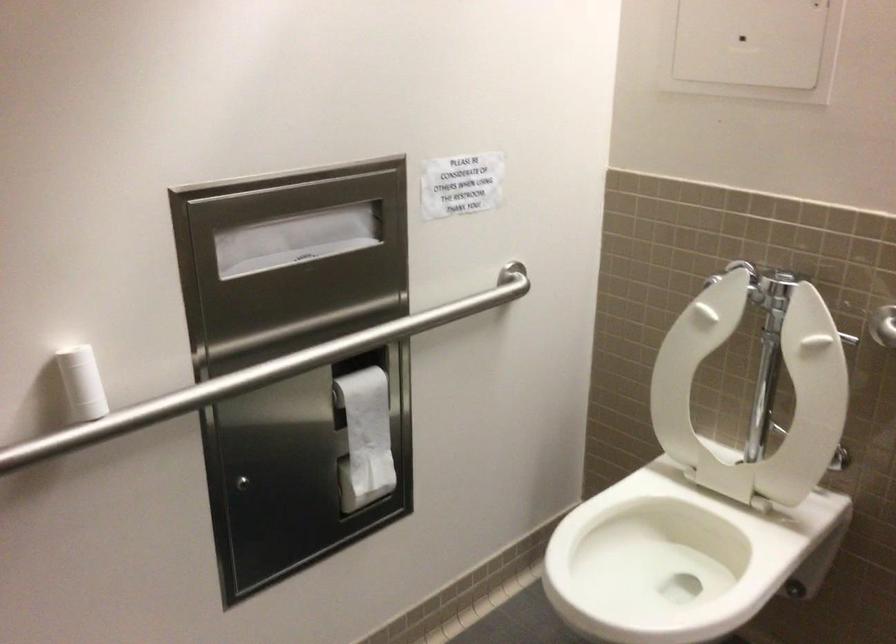
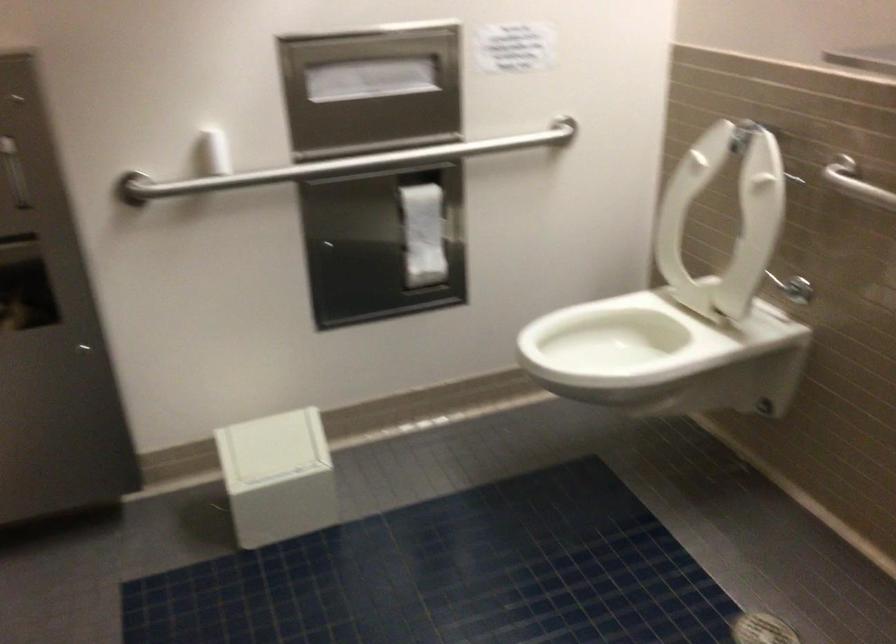
What movement of the cameraman would produce the second image?

The movement direction of the cameraman is right, backward.